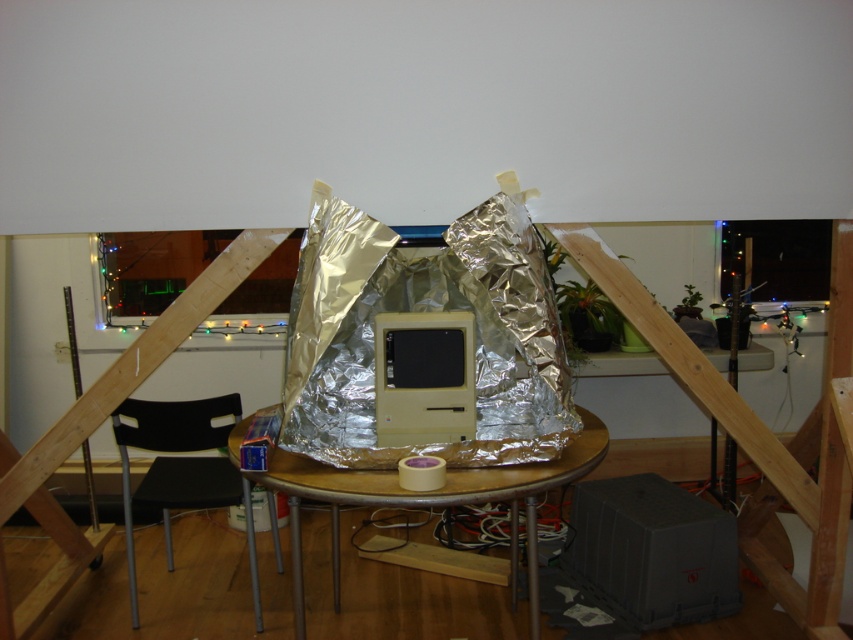
You are setting up a small desk in your room and have both a wooden table at center and a matte plastic desktop computer at center. If you want to place the computer on the table, will it fit based on their heights?

The wooden table at center is much taller than the matte plastic desktop computer at center, so the computer will fit on the table since the table is higher.

You are organizing a small event in the room and need to place a 30 cm wide decoration between the black plastic chair at lower left and the matte plastic desktop computer at center. Can the decoration fit between them without overlapping either object?

The black plastic chair at lower left is wider than the matte plastic desktop computer at center. Since the decoration is 30 cm wide, it can fit between them as long as the space between the two objects is at least 30 cm. However, the exact width of the space isn

You are sitting in the black plastic chair at lower left and want to reach the matte plastic desktop computer at center. Is the computer above or below your current position?

The black plastic chair at lower left is below matte plastic desktop computer at center, so the computer is above your current position.